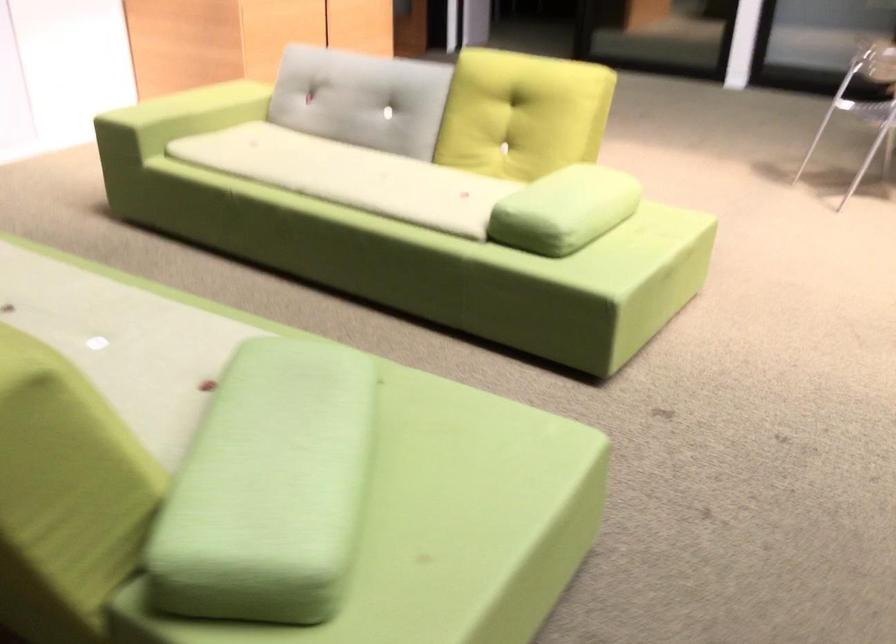
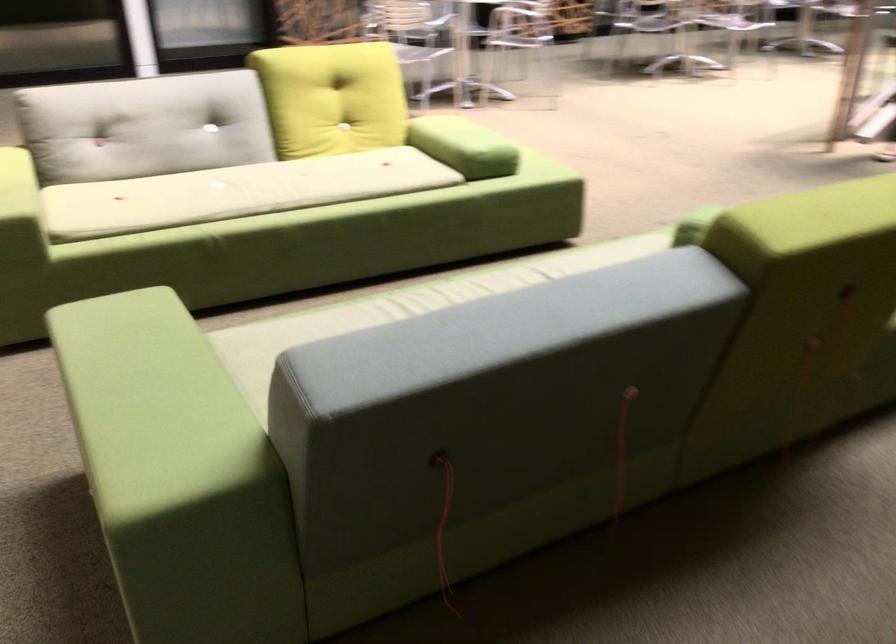
In the second image, find the point that corresponds to (x=263, y=359) in the first image.

(694, 225)